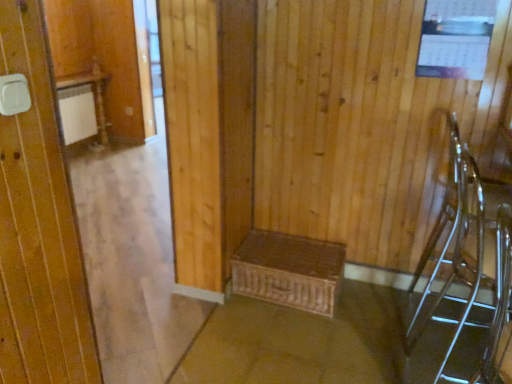
Image resolution: width=512 pixels, height=384 pixels. In order to click on woven brown chest at center in this screenshot , I will do `click(289, 271)`.

Measure the distance between woven brown chest at center and camera.

woven brown chest at center is 2.25 meters from camera.

Locate an element on the screen. This screenshot has height=384, width=512. clear glass armchair at right, which appears as the first armchair when viewed from the back is located at coordinates (464, 271).

At what (x,y) coordinates should I click in order to perform the action: click on clear plastic chair at right, which is the 1th armchair in front-to-back order. Please return your answer as a coordinate pair (x, y). The image size is (512, 384). Looking at the image, I should click on point(497,312).

Where is `woven brown chest at center`? The width and height of the screenshot is (512, 384). woven brown chest at center is located at coordinates (289, 271).

From a real-world perspective, which object rests below the other?

From a 3D spatial view, brown woven basket at lower center is below.

From the image's perspective, which one is positioned higher, brown woven basket at lower center or clear glass armchair at right, the 2th armchair positioned from the front?

From the image's view, clear glass armchair at right, the 2th armchair positioned from the front, is above.

Considering the sizes of brown woven basket at lower center and clear glass armchair at right, which appears as the first armchair when viewed from the back, in the image, is brown woven basket at lower center bigger or smaller than clear glass armchair at right, which appears as the first armchair when viewed from the back,?

Considering their sizes, brown woven basket at lower center takes up less space than clear glass armchair at right, which appears as the first armchair when viewed from the back.

Between clear plastic chair at right, which appears as the 2th armchair when viewed from the back, and clear glass armchair at right, the 2th armchair positioned from the front, which one has less height?

clear plastic chair at right, which appears as the 2th armchair when viewed from the back, is shorter.

How distant is clear plastic chair at right, which is the 1th armchair in front-to-back order, from clear glass armchair at right, which appears as the first armchair when viewed from the back?

clear plastic chair at right, which is the 1th armchair in front-to-back order, and clear glass armchair at right, which appears as the first armchair when viewed from the back, are 13.32 inches apart.

Consider the image. In terms of width, does clear plastic chair at right, which is the 1th armchair in front-to-back order, look wider or thinner when compared to clear glass armchair at right, the 2th armchair positioned from the front?

Considering their sizes, clear plastic chair at right, which is the 1th armchair in front-to-back order, looks slimmer than clear glass armchair at right, the 2th armchair positioned from the front.

Based on their sizes in the image, would you say clear glass armchair at right, the 2th armchair positioned from the front, is bigger or smaller than woven brown chest at center?

Considering their sizes, clear glass armchair at right, the 2th armchair positioned from the front, takes up more space than woven brown chest at center.

How many degrees apart are the facing directions of clear glass armchair at right, which appears as the first armchair when viewed from the back, and woven brown chest at center?

They differ by 94.6 degrees in their facing directions.

Is clear glass armchair at right, the 2th armchair positioned from the front, far away from woven brown chest at center?

clear glass armchair at right, the 2th armchair positioned from the front, is actually quite close to woven brown chest at center.

Consider the image. Considering their positions, is clear glass armchair at right, the 2th armchair positioned from the front, located in front of or behind woven brown chest at center?

In the image, clear glass armchair at right, the 2th armchair positioned from the front, appears in front of woven brown chest at center.

Which object is positioned more to the right, clear plastic chair at right, which appears as the 2th armchair when viewed from the back, or woven brown chest at center?

clear plastic chair at right, which appears as the 2th armchair when viewed from the back.

Does clear plastic chair at right, which is the 1th armchair in front-to-back order, have a smaller size compared to woven brown chest at center?

Incorrect, clear plastic chair at right, which is the 1th armchair in front-to-back order, is not smaller in size than woven brown chest at center.

Who is taller, clear plastic chair at right, which appears as the 2th armchair when viewed from the back, or woven brown chest at center?

clear plastic chair at right, which appears as the 2th armchair when viewed from the back.

From the image's perspective, is clear glass armchair at right, which appears as the first armchair when viewed from the back, located beneath clear plastic chair at right, which appears as the 2th armchair when viewed from the back?

No, from the image's perspective, clear glass armchair at right, which appears as the first armchair when viewed from the back, is not below clear plastic chair at right, which appears as the 2th armchair when viewed from the back.

Considering the positions of objects clear glass armchair at right, the 2th armchair positioned from the front, and clear plastic chair at right, which is the 1th armchair in front-to-back order, in the image provided, who is more to the left, clear glass armchair at right, the 2th armchair positioned from the front, or clear plastic chair at right, which is the 1th armchair in front-to-back order,?

From the viewer's perspective, clear plastic chair at right, which is the 1th armchair in front-to-back order, appears more on the left side.

Who is bigger, clear glass armchair at right, the 2th armchair positioned from the front, or clear plastic chair at right, which appears as the 2th armchair when viewed from the back?

clear glass armchair at right, the 2th armchair positioned from the front, is bigger.

Considering the points (382, 363) and (336, 293), which point is behind, point (382, 363) or point (336, 293)?

The point (336, 293) is farther.

Measure the distance from brown woven basket at lower center to woven brown chest at center.

brown woven basket at lower center and woven brown chest at center are 10.82 inches apart from each other.

Are brown woven basket at lower center and woven brown chest at center located far from each other?

No, brown woven basket at lower center is not far from woven brown chest at center.

Considering the positions of objects brown woven basket at lower center and woven brown chest at center in the image provided, who is behind, brown woven basket at lower center or woven brown chest at center?

Positioned behind is woven brown chest at center.

From a real-world perspective, is woven brown chest at center positioned above or below clear glass armchair at right, the 2th armchair positioned from the front?

woven brown chest at center is situated lower than clear glass armchair at right, the 2th armchair positioned from the front, in the real world.

Is woven brown chest at center oriented towards clear glass armchair at right, which appears as the first armchair when viewed from the back?

No, woven brown chest at center is not turned towards clear glass armchair at right, which appears as the first armchair when viewed from the back.

Which point is more distant from viewer, (307,299) or (481,278)?

The point (307,299) is behind.

Locate an element on the screen. The width and height of the screenshot is (512, 384). concrete below the clear glass armchair at right, the 2th armchair positioned from the front (from the image's perspective) is located at coordinates (315, 342).

The height and width of the screenshot is (384, 512). I want to click on armchair that appears behind the clear plastic chair at right, which is the 1th armchair in front-to-back order, so click(x=464, y=271).

Looking at the image, which one is located closer to woven brown chest at center, clear glass armchair at right, which appears as the first armchair when viewed from the back, or brown woven basket at lower center?

Based on the image, brown woven basket at lower center appears to be nearer to woven brown chest at center.

Which object lies further to the anchor point clear plastic chair at right, which appears as the 2th armchair when viewed from the back, woven brown chest at center or clear glass armchair at right, which appears as the first armchair when viewed from the back?

woven brown chest at center.

Based on their spatial positions, is brown woven basket at lower center or clear glass armchair at right, the 2th armchair positioned from the front, further from clear plastic chair at right, which is the 1th armchair in front-to-back order?

Among the two, brown woven basket at lower center is located further to clear plastic chair at right, which is the 1th armchair in front-to-back order.

Based on their spatial positions, is clear glass armchair at right, the 2th armchair positioned from the front, or clear plastic chair at right, which is the 1th armchair in front-to-back order, further from brown woven basket at lower center?

The object further to brown woven basket at lower center is clear plastic chair at right, which is the 1th armchair in front-to-back order.

Looking at this image, which object lies nearer to the anchor point clear glass armchair at right, the 2th armchair positioned from the front, brown woven basket at lower center or clear plastic chair at right, which is the 1th armchair in front-to-back order?

clear plastic chair at right, which is the 1th armchair in front-to-back order, is positioned closer to the anchor clear glass armchair at right, the 2th armchair positioned from the front.

Based on their spatial positions, is woven brown chest at center or clear plastic chair at right, which appears as the 2th armchair when viewed from the back, closer to brown woven basket at lower center?

woven brown chest at center is positioned closer to the anchor brown woven basket at lower center.

Based on their spatial positions, is clear glass armchair at right, which appears as the first armchair when viewed from the back, or clear plastic chair at right, which is the 1th armchair in front-to-back order, closer to woven brown chest at center?

The object closer to woven brown chest at center is clear glass armchair at right, which appears as the first armchair when viewed from the back.

From the image, which object appears to be farther from clear plastic chair at right, which is the 1th armchair in front-to-back order, woven brown chest at center or brown woven basket at lower center?

Based on the image, woven brown chest at center appears to be further to clear plastic chair at right, which is the 1th armchair in front-to-back order.

The image size is (512, 384). I want to click on concrete between clear glass armchair at right, which appears as the first armchair when viewed from the back, and woven brown chest at center, along the z-axis, so coord(315,342).

Locate an element on the screen. This screenshot has height=384, width=512. armchair between clear plastic chair at right, which is the 1th armchair in front-to-back order, and brown woven basket at lower center from front to back is located at coordinates (464, 271).

Identify the location of concrete between clear plastic chair at right, which is the 1th armchair in front-to-back order, and woven brown chest at center, along the z-axis. (315, 342).

At what (x,y) coordinates should I click in order to perform the action: click on armchair between clear plastic chair at right, which is the 1th armchair in front-to-back order, and woven brown chest at center in the front-back direction. Please return your answer as a coordinate pair (x, y). Looking at the image, I should click on (464, 271).